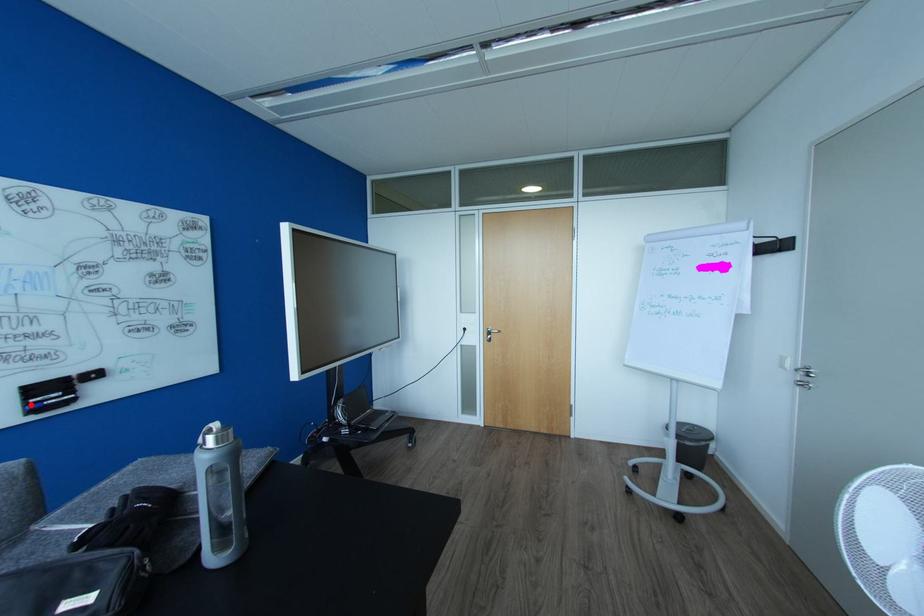
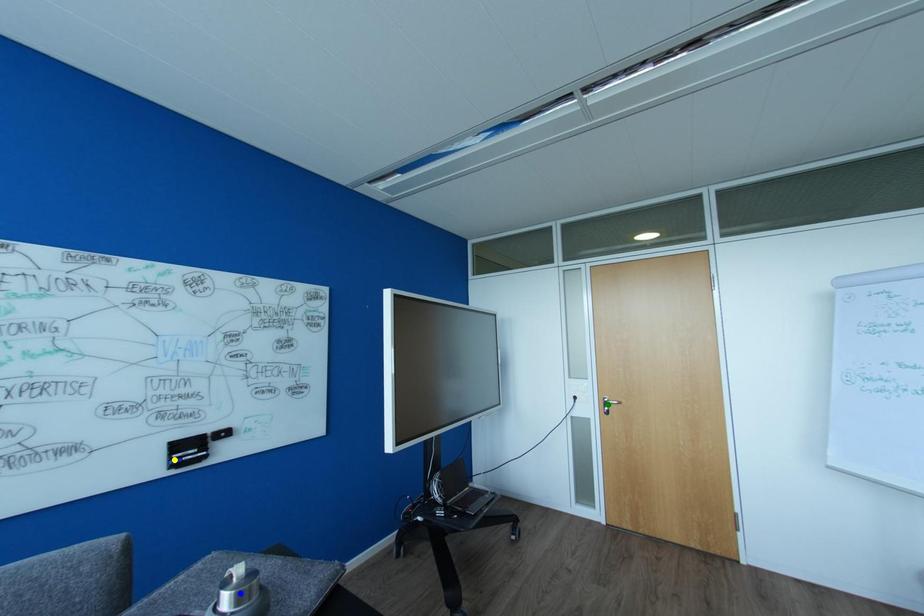
Question: I am providing you with two images of the same scene from different viewpoints. A red point is marked on the first image. You are given multiple points on the second image. Which point in image 2 represents the same 3d spot as the red point in image 1?

Choices:
 (A) yellow point
 (B) blue point
 (C) green point

Answer: (A)